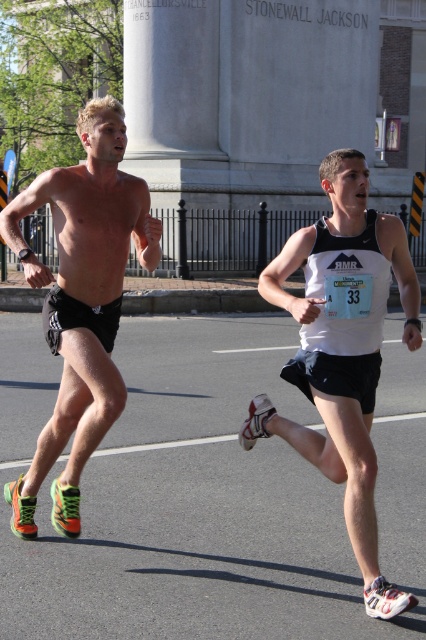
Question: In this image, where is white matte tank top at center located relative to neon green synthetic running shoes at left?

Choices:
 (A) above
 (B) below

Answer: (B)

Question: Can you confirm if white matte tank top at center is wider than neon green synthetic running shoes at left?

Choices:
 (A) no
 (B) yes

Answer: (A)

Question: Is white matte tank top at center to the left of neon green synthetic running shoes at left from the viewer's perspective?

Choices:
 (A) no
 (B) yes

Answer: (A)

Question: Which object is farther from the camera taking this photo?

Choices:
 (A) neon green synthetic running shoes at left
 (B) white matte tank top at center

Answer: (A)

Question: Which of the following is the farthest from the observer?

Choices:
 (A) (100, 260)
 (B) (376, 285)

Answer: (A)